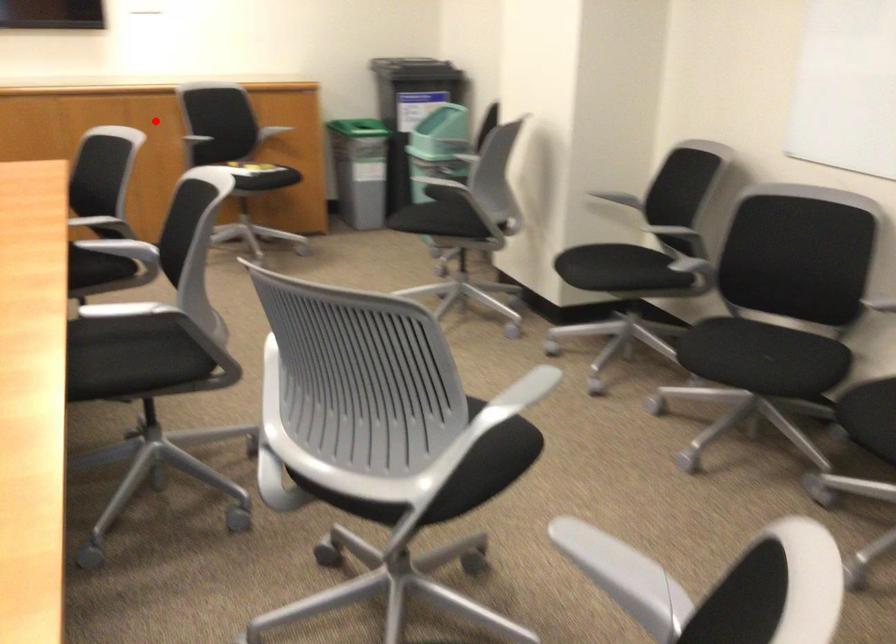
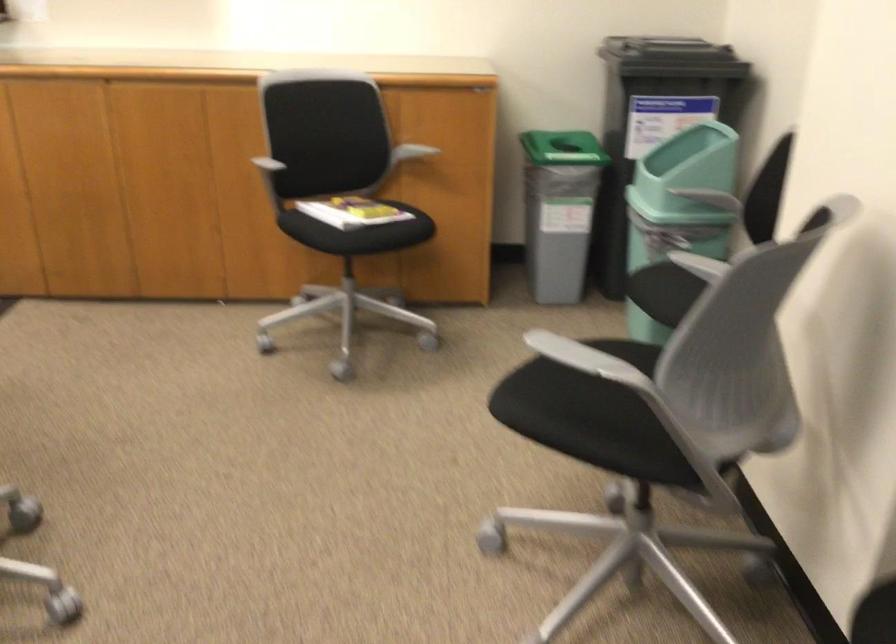
The point at the highlighted location is marked in the first image. Where is the corresponding point in the second image?

(236, 149)